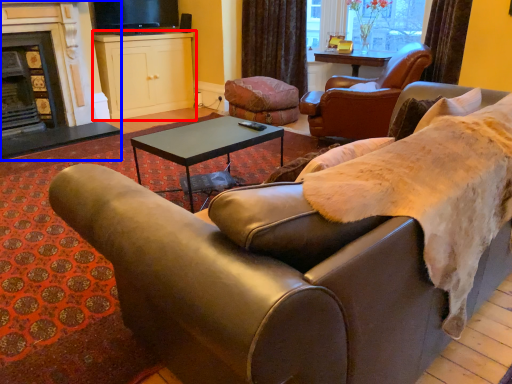
Question: Which point is further to the camera, cabinetry (highlighted by a red box) or fireplace (highlighted by a blue box)?

Choices:
 (A) cabinetry
 (B) fireplace

Answer: (A)